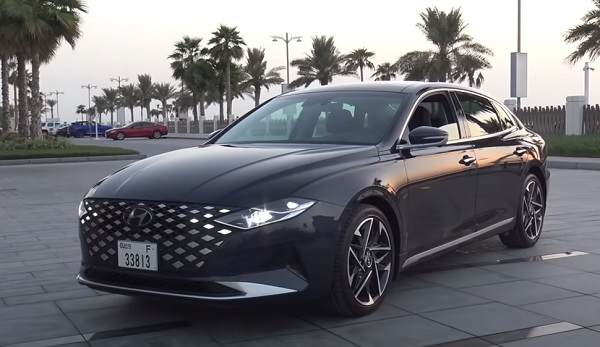
What are the coordinates of `door` in the screenshot? It's located at (491, 182), (448, 190).